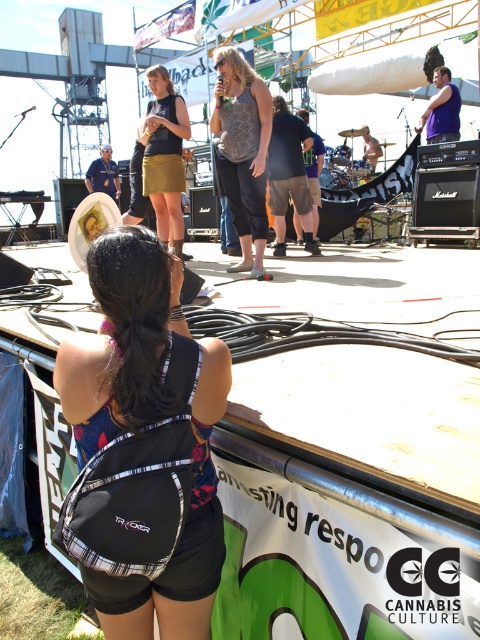
You are a costume designer preparing for a performance. You have two options for the lead singer at the center of the stage. The first is a textured gray tank top at center, and the second is a gold skirt at center. The singer prefers clothing that allows for more movement. Based on the description, which outfit would you recommend?

The textured gray tank top at center has a smaller width than the gold skirt at center, so it might be more flexible and allow for easier movement during the performance.

Based on the photo, you are a photographer at the event and want to capture both the black fabric backpack at center and the textured gray tank top at center in your shot. Which object should you focus on first to ensure both are in focus?

Since the black fabric backpack at center is closer to the viewer than the textured gray tank top at center, you should focus on the backpack first. This way, the tank top will naturally fall into the depth of field and remain in focus as well.